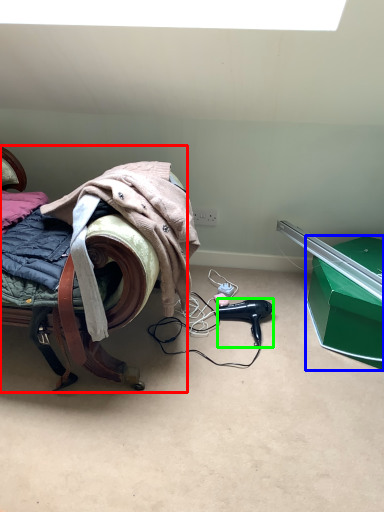
Question: Which object is positioned farthest from furniture (highlighted by a red box)? Select from box (highlighted by a blue box) and hair dryer (highlighted by a green box).

Choices:
 (A) box
 (B) hair dryer

Answer: (A)